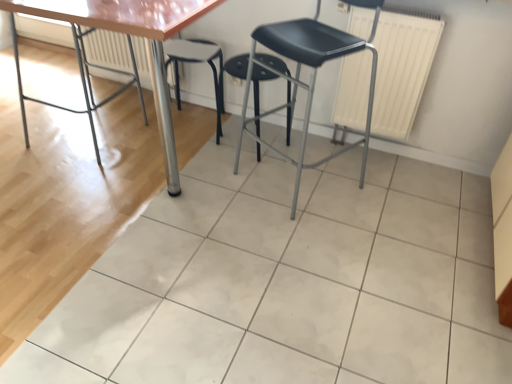
You are a GUI agent. You are given a task and a screenshot of the screen. Output one action in this format:
    pyautogui.click(x=<x>, y=<y>)
    Task: Click on the free space between black plastic stool at center, arranged as the 1th stool when viewed from the left, and black plastic stool at center, the 1th stool viewed from the right
    
    Given the screenshot: What is the action you would take?
    pyautogui.click(x=207, y=141)